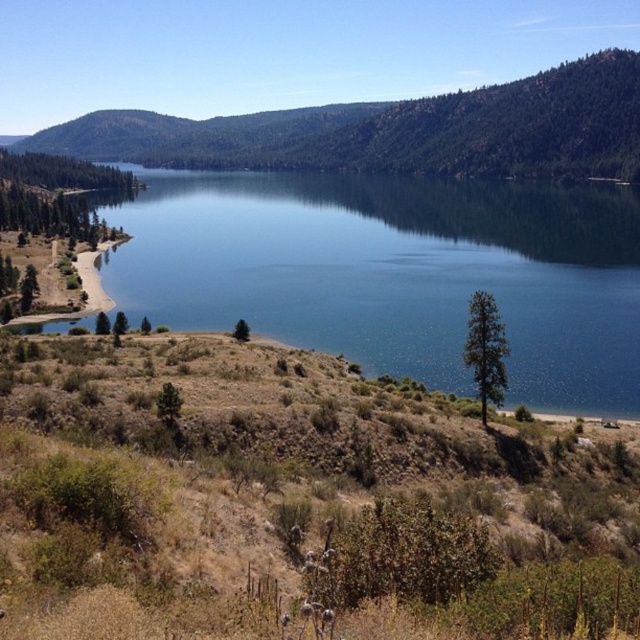
Which is more to the left, blue reflective water at center or green forested mountain at upper center?

Positioned to the left is green forested mountain at upper center.

Is blue reflective water at center positioned in front of green forested mountain at upper center?

That is True.

Which is in front, point (209, 204) or point (490, 122)?

Point (209, 204) is in front.

The image size is (640, 640). In order to click on blue reflective water at center in this screenshot , I will do `click(396, 273)`.